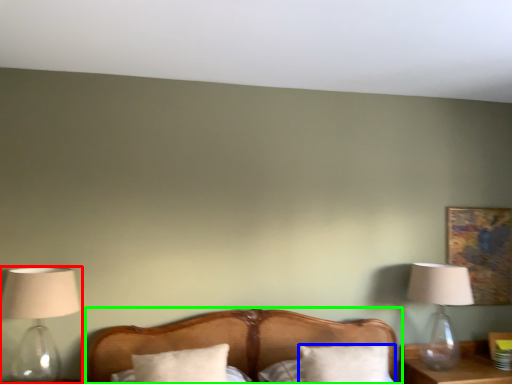
Question: Based on their relative distances, which object is farther from lamp (highlighted by a red box)? Choose from pillow (highlighted by a blue box) and bed (highlighted by a green box).

Choices:
 (A) pillow
 (B) bed

Answer: (A)